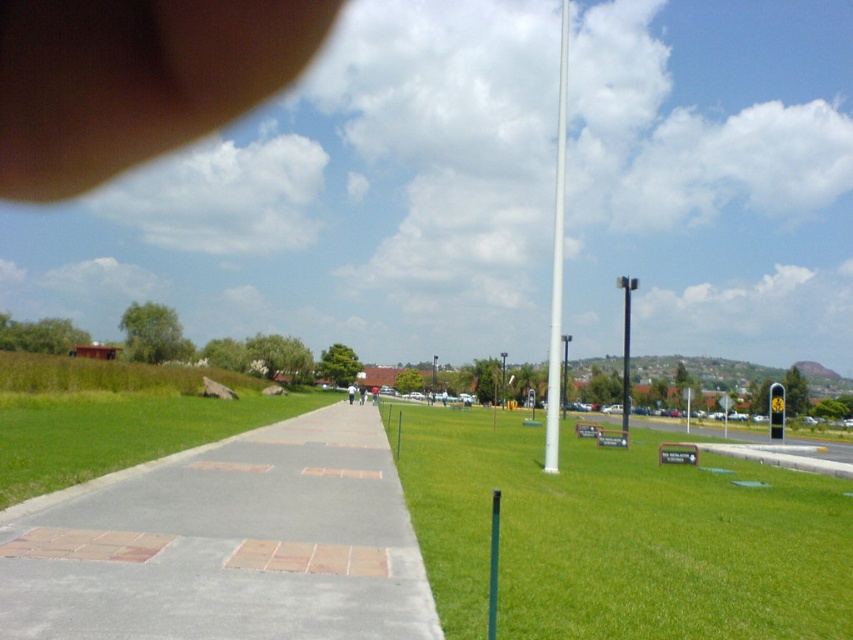
Question: Does green grass at center have a larger size compared to gray concrete sidewalk at lower left?

Choices:
 (A) no
 (B) yes

Answer: (B)

Question: Is green grass at center closer to the viewer compared to gray concrete sidewalk at lower left?

Choices:
 (A) no
 (B) yes

Answer: (A)

Question: Does green grass at center appear under white glossy pole at center?

Choices:
 (A) no
 (B) yes

Answer: (B)

Question: Which object is the farthest from the gray concrete sidewalk at lower left?

Choices:
 (A) white glossy pole at center
 (B) green grass at center

Answer: (A)

Question: Estimate the real-world distances between objects in this image. Which object is farther from the green grass at center?

Choices:
 (A) gray concrete sidewalk at lower left
 (B) white glossy pole at center

Answer: (B)

Question: Estimate the real-world distances between objects in this image. Which object is farther from the gray concrete sidewalk at lower left?

Choices:
 (A) green grass at center
 (B) white glossy pole at center

Answer: (B)